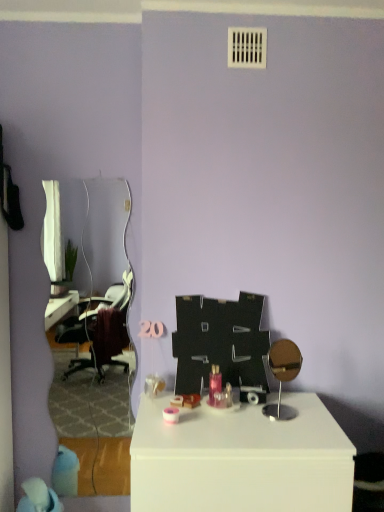
Measure the distance between point (x=19, y=506) and camera.

The distance of point (x=19, y=506) from camera is 1.98 meters.

In order to face blue fabric bean bag chair at lower left, should I rotate leftwards or rightwards?

You should rotate left by 19.734 degrees.

Measure the distance between white glossy mirror at left and camera.

A distance of 9.22 feet exists between white glossy mirror at left and camera.

This screenshot has height=512, width=384. I want to click on white glossy mirror at left, so click(x=88, y=303).

Identify the location of blue fabric bean bag chair at lower left. (38, 497).

Is point (267, 504) positioned in front of point (122, 390)?

Yes.

Is white glossy table at center in front of or behind white glossy mirror at left in the image?

Clearly, white glossy table at center is in front of white glossy mirror at left.

How far apart are white glossy table at center and white glossy mirror at left?

A distance of 5.52 feet exists between white glossy table at center and white glossy mirror at left.

Based on their positions, is white glossy table at center located to the left or right of white glossy mirror at left?

Based on their positions, white glossy table at center is located to the right of white glossy mirror at left.

From the image's perspective, which one is positioned higher, white glossy mirror at left or blue fabric bean bag chair at lower left?

white glossy mirror at left, from the image's perspective.

Considering the points (91, 367) and (52, 496), which point is behind, point (91, 367) or point (52, 496)?

The point (91, 367) is behind.

Is white glossy mirror at left far from blue fabric bean bag chair at lower left?

Yes, white glossy mirror at left and blue fabric bean bag chair at lower left are quite far apart.

Between blue fabric bean bag chair at lower left and white glossy mirror at left, which one has larger width?

blue fabric bean bag chair at lower left is wider.

How much distance is there between blue fabric bean bag chair at lower left and white glossy mirror at left?

They are 1.34 meters apart.

Is point (54, 504) positioned before point (97, 225)?

Yes, it is in front of point (97, 225).

The image size is (384, 512). What are the coordinates of `mirror behind the blue fabric bean bag chair at lower left` in the screenshot? It's located at (88, 303).

From the image's perspective, which is below, white glossy mirror at left or white glossy table at center?

white glossy table at center appears lower in the image.

Is white glossy table at center at the back of white glossy mirror at left?

No.

Where is `table that is below the white glossy mirror at left (from the image's perspective)`? Image resolution: width=384 pixels, height=512 pixels. table that is below the white glossy mirror at left (from the image's perspective) is located at coordinates (240, 459).

Considering the sizes of objects white glossy mirror at left and white glossy table at center in the image provided, who is shorter, white glossy mirror at left or white glossy table at center?

white glossy table at center is shorter.

Does point (350, 464) come in front of point (55, 493)?

Yes, point (350, 464) is closer to viewer.

Considering the sizes of white glossy table at center and blue fabric bean bag chair at lower left in the image, is white glossy table at center taller or shorter than blue fabric bean bag chair at lower left?

white glossy table at center is taller than blue fabric bean bag chair at lower left.

From a real-world perspective, is white glossy table at center above or below blue fabric bean bag chair at lower left?

Clearly, from a real-world perspective, white glossy table at center is above blue fabric bean bag chair at lower left.

Is white glossy table at center to the right of blue fabric bean bag chair at lower left from the viewer's perspective?

Yes.

From the image's perspective, which one is positioned lower, blue fabric bean bag chair at lower left or white glossy table at center?

blue fabric bean bag chair at lower left is shown below in the image.

Is blue fabric bean bag chair at lower left not close to white glossy table at center?

Yes, blue fabric bean bag chair at lower left is far from white glossy table at center.

Can you confirm if blue fabric bean bag chair at lower left is taller than white glossy table at center?

No.

Could you tell me if blue fabric bean bag chair at lower left is turned towards white glossy table at center?

No, blue fabric bean bag chair at lower left is not facing towards white glossy table at center.

What are the coordinates of `table below the white glossy mirror at left (from a real-world perspective)` in the screenshot? It's located at (240, 459).

The height and width of the screenshot is (512, 384). Find the location of `bean bag chair in front of the white glossy mirror at left`. bean bag chair in front of the white glossy mirror at left is located at coordinates (38, 497).

When comparing their distances from blue fabric bean bag chair at lower left, does white glossy table at center or white glossy mirror at left seem further?

Among the two, white glossy mirror at left is located further to blue fabric bean bag chair at lower left.

Based on the photo, which object lies further to the anchor point white glossy table at center, white glossy mirror at left or blue fabric bean bag chair at lower left?

Among the two, white glossy mirror at left is located further to white glossy table at center.

Consider the image. Considering their positions, is white glossy table at center positioned further to white glossy mirror at left than blue fabric bean bag chair at lower left?

white glossy table at center lies further to white glossy mirror at left than the other object.

In the scene shown: Which object lies further to the anchor point white glossy table at center, blue fabric bean bag chair at lower left or white glossy mirror at left?

white glossy mirror at left lies further to white glossy table at center than the other object.

Estimate the real-world distances between objects in this image. Which object is further from blue fabric bean bag chair at lower left, white glossy mirror at left or white glossy table at center?

white glossy mirror at left is positioned further to the anchor blue fabric bean bag chair at lower left.

Estimate the real-world distances between objects in this image. Which object is further from white glossy mirror at left, blue fabric bean bag chair at lower left or white glossy table at center?

The object further to white glossy mirror at left is white glossy table at center.

Locate an element on the screen. This screenshot has height=512, width=384. mirror situated between blue fabric bean bag chair at lower left and white glossy table at center from left to right is located at coordinates (88, 303).